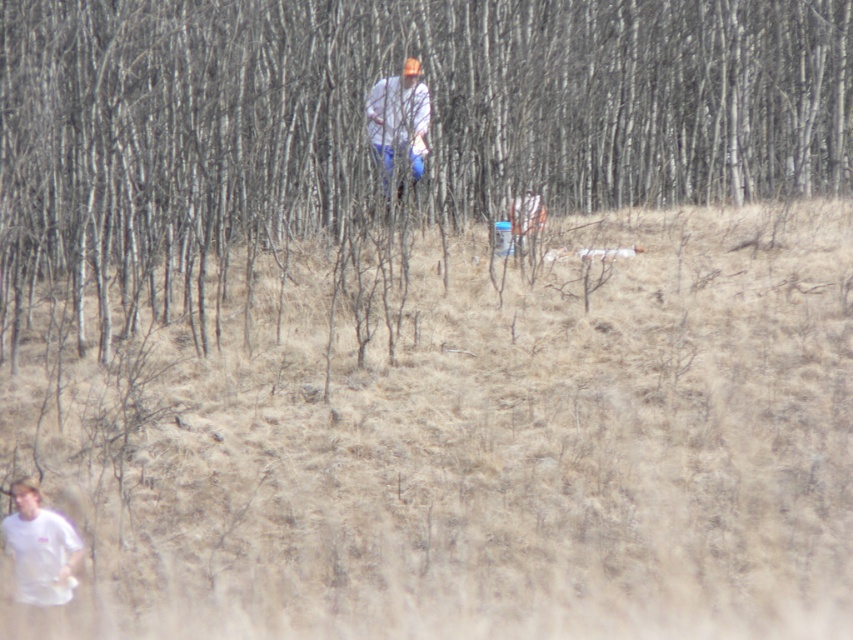
Is brown grass at center taller than white matte t-shirt at lower left?

Yes.

Locate an element on the screen. brown grass at center is located at coordinates (476, 444).

Locate an element on the screen. brown grass at center is located at coordinates (476, 444).

Based on the photo, between white matte t-shirt at lower left and white matte shirt at center, which one is positioned lower?

white matte t-shirt at lower left

Between point (59, 536) and point (399, 92), which one is positioned in front?

Point (59, 536) is in front.

The width and height of the screenshot is (853, 640). I want to click on white matte t-shirt at lower left, so click(39, 548).

Identify the location of white matte t-shirt at lower left. Image resolution: width=853 pixels, height=640 pixels. (39, 548).

Is brown bark tree at center smaller than white matte t-shirt at lower left?

Actually, brown bark tree at center might be larger than white matte t-shirt at lower left.

Does brown bark tree at center have a lesser height compared to white matte t-shirt at lower left?

No, brown bark tree at center is not shorter than white matte t-shirt at lower left.

The height and width of the screenshot is (640, 853). What are the coordinates of `brown bark tree at center` in the screenshot? It's located at point(364,125).